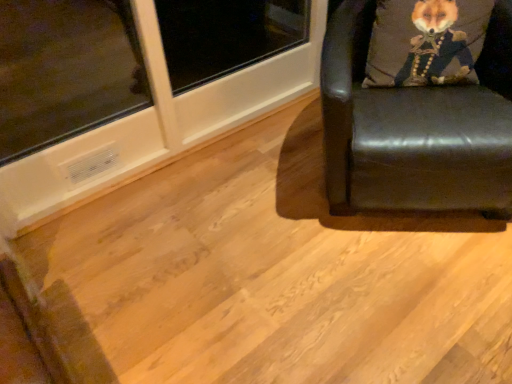
Locate an element on the screen. The width and height of the screenshot is (512, 384). free space to the left of black leather chair at right is located at coordinates (239, 201).